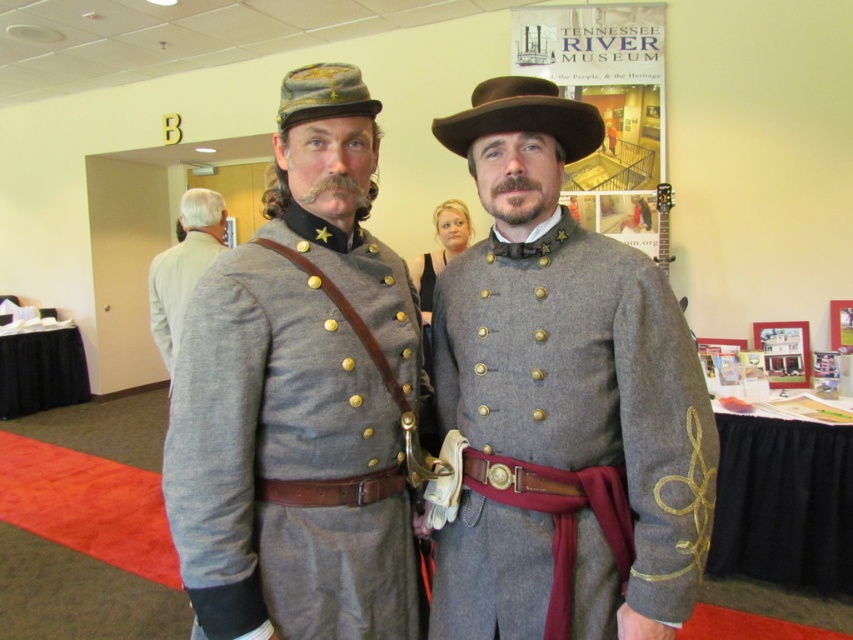
Question: Can you confirm if matte gray uniform at center is positioned to the left of gray wool uniform at left?

Choices:
 (A) yes
 (B) no

Answer: (B)

Question: Does matte gray uniform at center appear on the left side of gray wool uniform at center?

Choices:
 (A) yes
 (B) no

Answer: (A)

Question: Is gray wool uniforms at center in front of matte gray uniform at center?

Choices:
 (A) no
 (B) yes

Answer: (A)

Question: Which point appears closest to the camera in this image?

Choices:
 (A) (512, 113)
 (B) (595, 602)
 (C) (183, 388)
 (D) (300, 349)

Answer: (C)

Question: Which point is farther to the camera?

Choices:
 (A) gray wool uniform at center
 (B) matte gray uniform at center
 (C) gray wool uniform at left
 (D) brown felt cowboy hat at center

Answer: (C)

Question: Which of the following is the farthest from the observer?

Choices:
 (A) (662, 394)
 (B) (527, 257)
 (C) (218, 204)

Answer: (C)